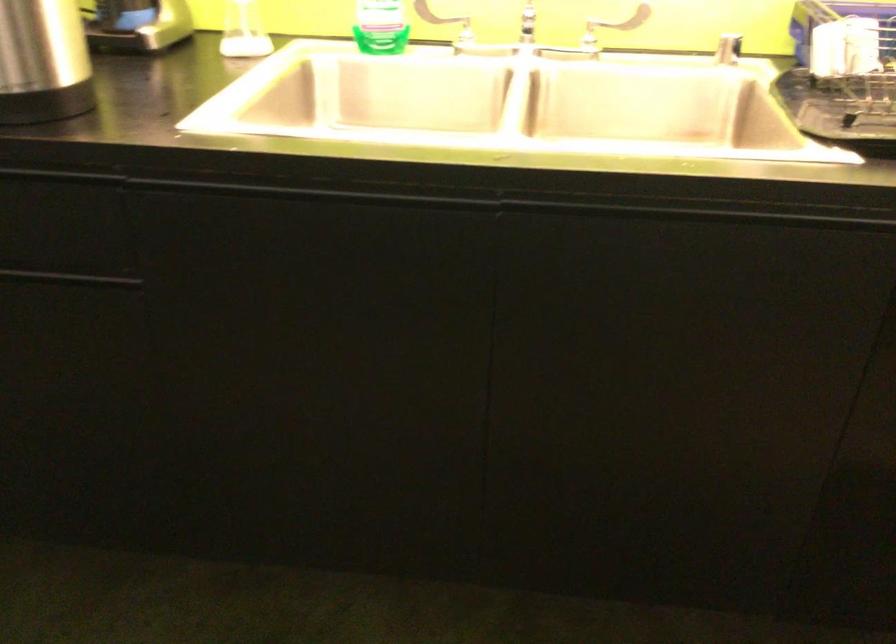
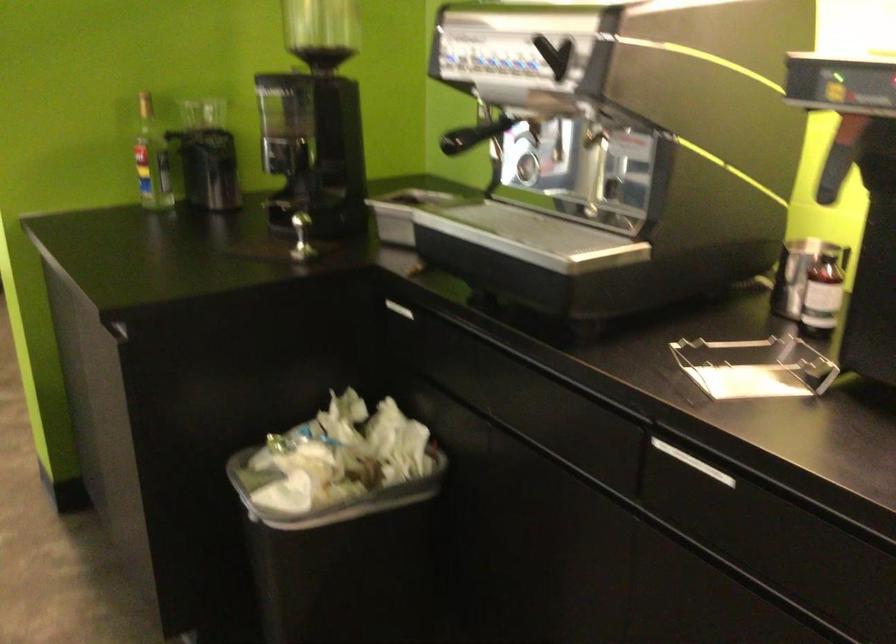
Question: The camera is either moving clockwise (left) or counter-clockwise (right) around the object. The first image is from the beginning of the video and the second image is from the end. Is the camera moving left or right when shooting the video?

Choices:
 (A) Left
 (B) Right

Answer: (B)